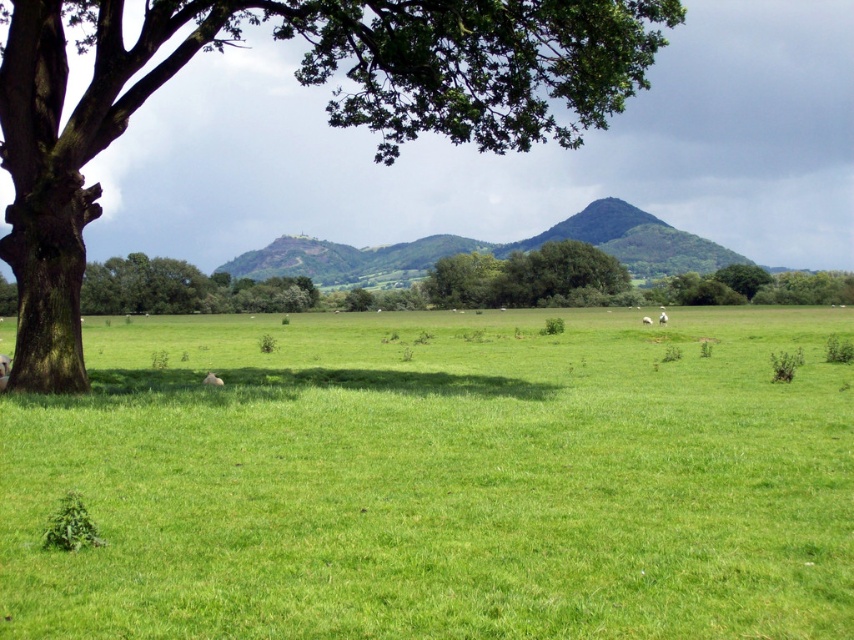
Question: Can you confirm if green leafy tree at left is smaller than white woolly sheep at center?

Choices:
 (A) yes
 (B) no

Answer: (B)

Question: Which object is the closest to the white woolly sheep at center?

Choices:
 (A) green leafy tree at left
 (B) green grass pasture at center
 (C) green textured hill at center

Answer: (B)

Question: Is green grass pasture at center in front of white fluffy sheep at center?

Choices:
 (A) no
 (B) yes

Answer: (B)

Question: Which point is farther from the camera taking this photo?

Choices:
 (A) (118, 461)
 (B) (379, 257)
 (C) (661, 316)
 (D) (57, 220)

Answer: (B)

Question: Which point is farther from the camera taking this photo?

Choices:
 (A) (91, 211)
 (B) (291, 506)
 (C) (659, 323)

Answer: (C)

Question: Is green leafy tree at left wider than white fluffy sheep at center?

Choices:
 (A) yes
 (B) no

Answer: (A)